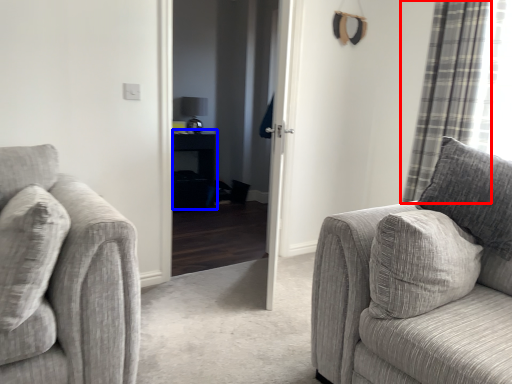
Question: Which object is further to the camera taking this photo, curtain (highlighted by a red box) or table (highlighted by a blue box)?

Choices:
 (A) curtain
 (B) table

Answer: (B)